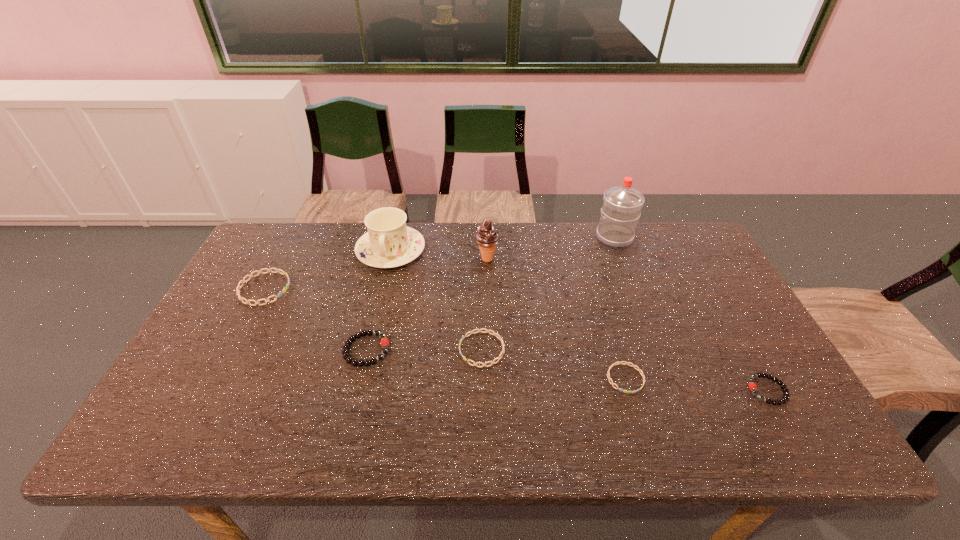
This screenshot has height=540, width=960. I want to click on the tallest object, so (621, 209).

Where is `water bottle`? The height and width of the screenshot is (540, 960). water bottle is located at coordinates (621, 209).

What are the coordinates of `the seventh shortest object` in the screenshot? It's located at (487, 238).

In order to click on chocolate icecream in this screenshot , I will do `click(487, 238)`.

In order to click on chinaware in this screenshot , I will do pos(389,243).

What are the coordinates of `the farthest bracelet` in the screenshot? It's located at (243, 281).

At what (x,y) coordinates should I click in order to perform the action: click on the farthest blue bracelet. Please return your answer as a coordinate pair (x, y). The image size is (960, 540). Looking at the image, I should click on (243, 281).

This screenshot has width=960, height=540. Find the location of `the farther black bracelet`. the farther black bracelet is located at coordinates (384, 342).

Locate an element on the screen. The width and height of the screenshot is (960, 540). the left black bracelet is located at coordinates (384, 342).

Locate an element on the screen. the third bracelet from right to left is located at coordinates (479, 330).